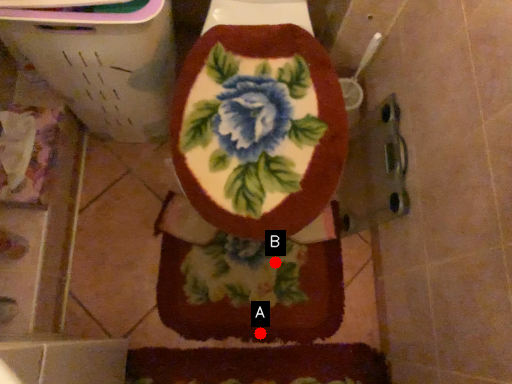
Question: Two points are circled on the image, labeled by A and B beside each circle. Which point appears farthest from the camera in this image?

Choices:
 (A) A is further
 (B) B is further

Answer: (B)